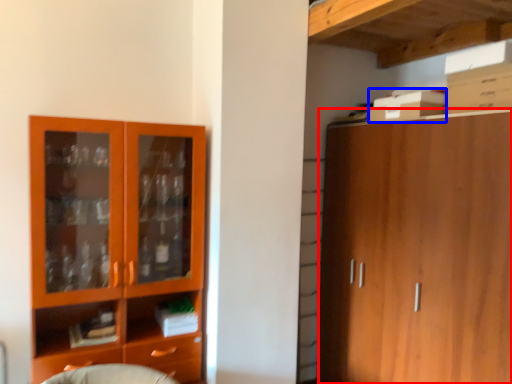
Question: Which object is further to the camera taking this photo, cabinetry (highlighted by a red box) or cardboard box (highlighted by a blue box)?

Choices:
 (A) cabinetry
 (B) cardboard box

Answer: (B)